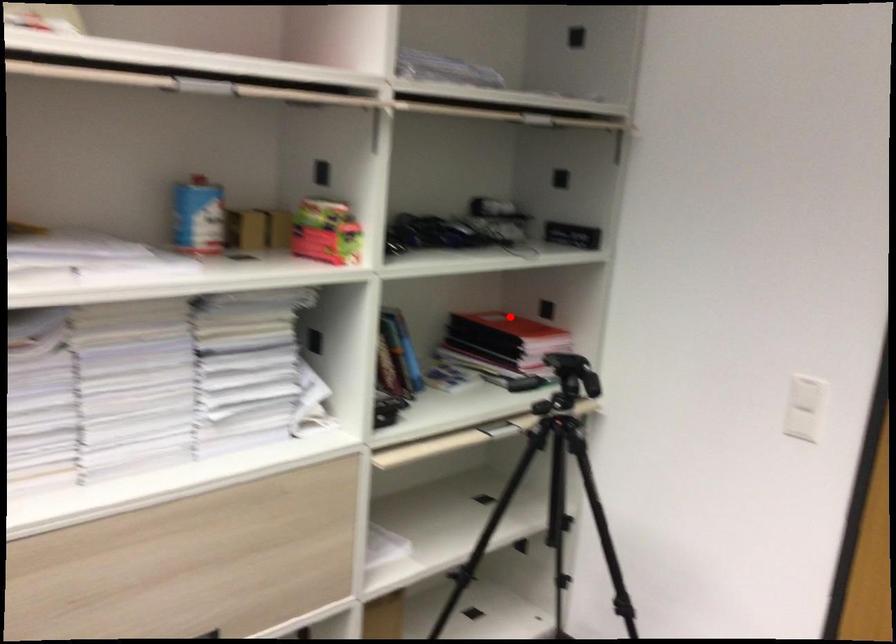
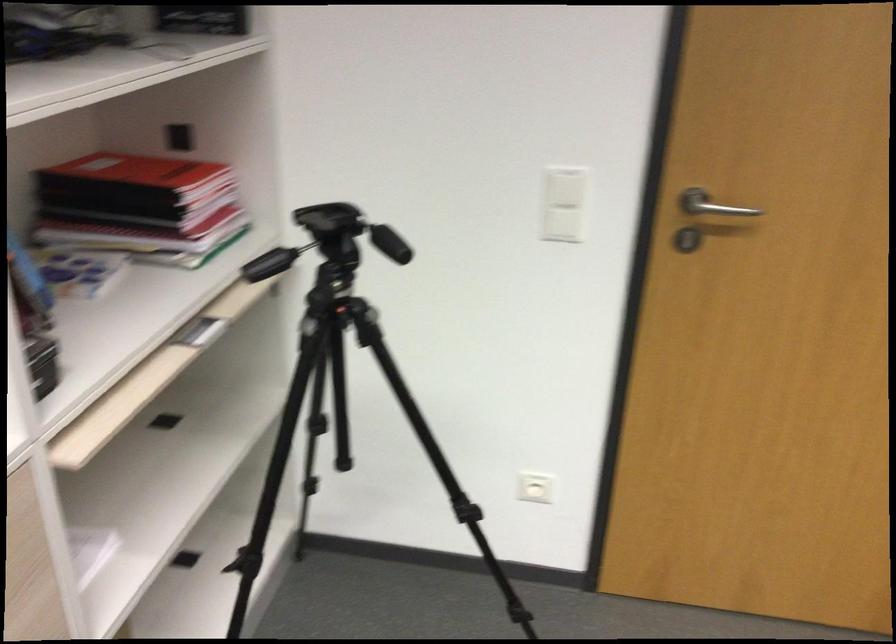
Find the pixel in the second image that matches the highlighted location in the first image.

(133, 172)